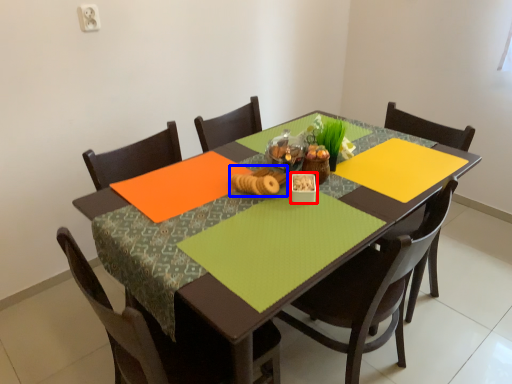
Question: Which object appears closest to the camera in this image, tableware (highlighted by a red box) or food (highlighted by a blue box)?

Choices:
 (A) tableware
 (B) food

Answer: (B)